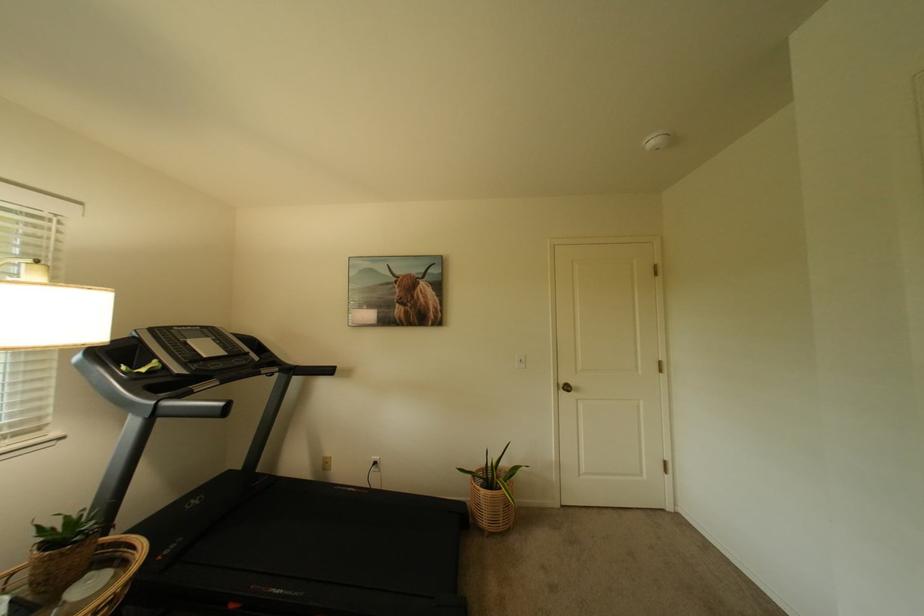
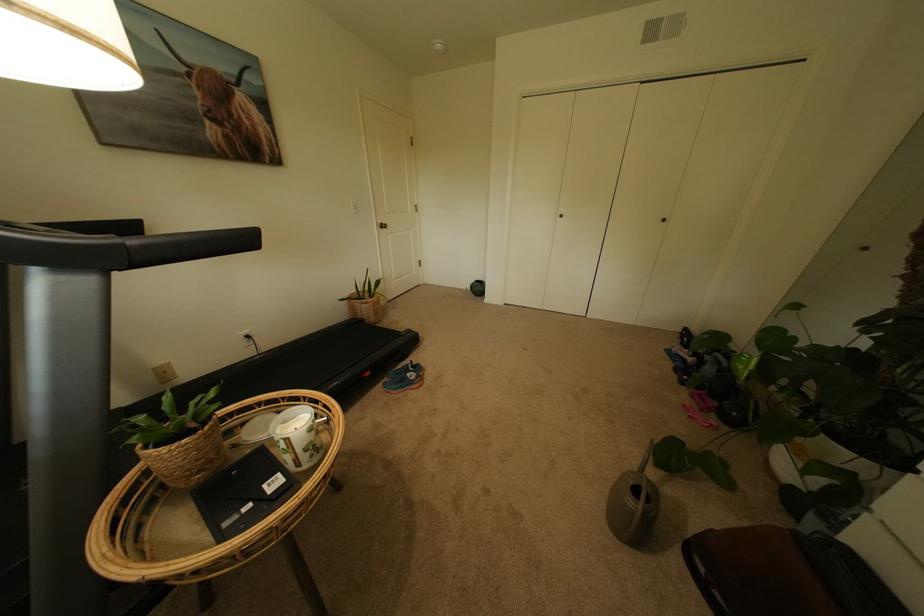
Locate, in the second image, the point that corresponds to (495,515) in the first image.

(382, 314)